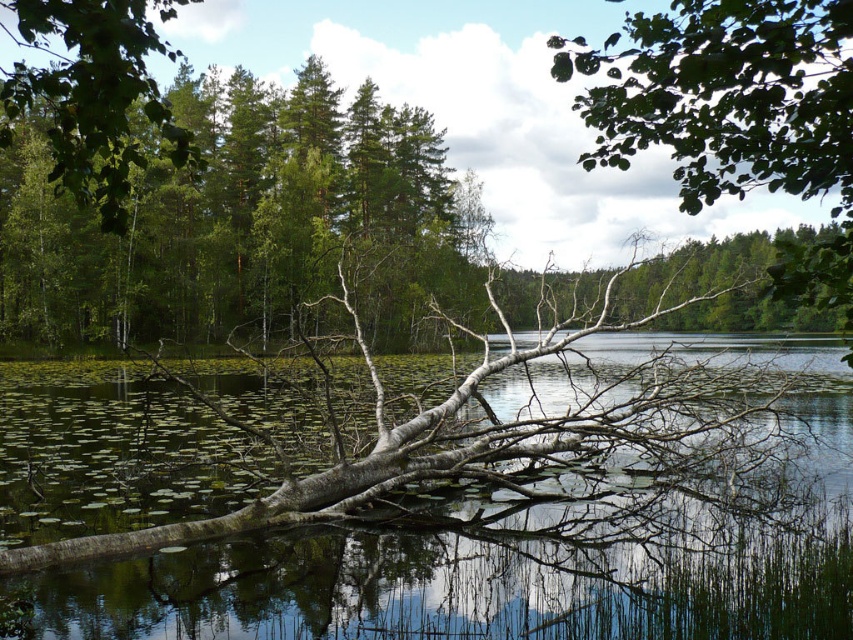
You are a photographer standing at the edge of the water. You want to capture a photo where both the transparent water at center and the green matte tree at upper left are visible in the frame. Based on their positions, which object should you focus on first to ensure both are in the shot?

Since the transparent water at center is to the right of the green matte tree at upper left, you should focus on the green matte tree at upper left first to ensure both objects are in the frame.

You are an environmental scientist assessing the scene. You need to determine the relative heights of the transparent water at center and the green matte tree at upper left. Which object is taller?

The green matte tree at upper left is taller than the transparent water at center.

You are standing at the edge of the water in the serene natural scene. You want to place a small decorative stone at point (538, 536). However, you are concerned about disturbing the lily pads. What is present at that specific point?

At point (538, 536) lies transparent water at center, so placing the stone there would not disturb the lily pads as there are none at that exact location.